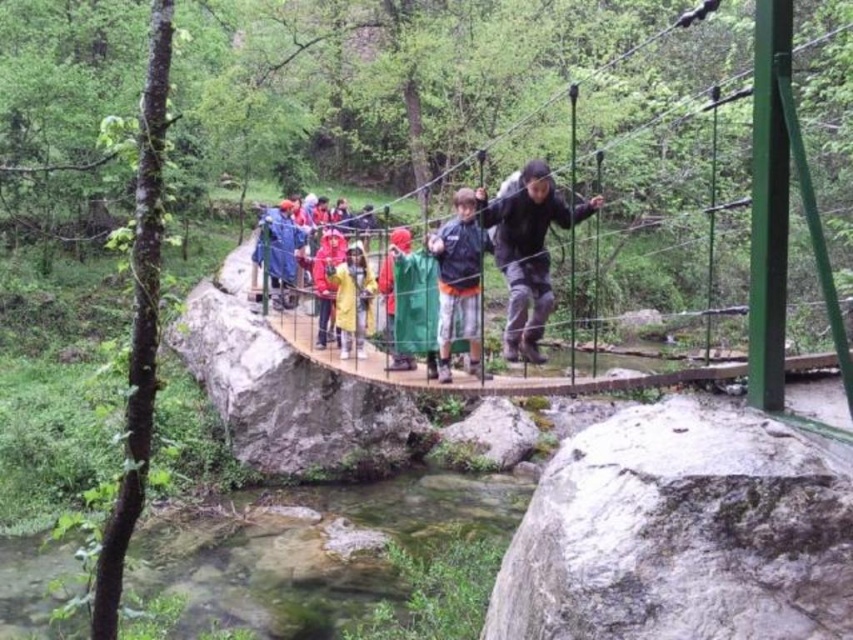
Question: Which point is closer to the camera?

Choices:
 (A) (845, 515)
 (B) (238, 320)
 (C) (268, 257)

Answer: (A)

Question: Is gray/rough rock at lower right positioned before yellow waterproof jacket at center?

Choices:
 (A) yes
 (B) no

Answer: (A)

Question: Which point appears farthest from the camera in this image?

Choices:
 (A) (769, 10)
 (B) (389, 364)
 (C) (231, 304)
 (D) (527, 301)

Answer: (C)

Question: Which point appears farthest from the camera in this image?

Choices:
 (A) (302, 467)
 (B) (273, 225)
 (C) (329, 515)

Answer: (B)

Question: Does smooth gray rock at center appear over yellow waterproof jacket at center?

Choices:
 (A) no
 (B) yes

Answer: (A)

Question: Can you confirm if gray/rough rock at lower right is bigger than wooden bridge at center?

Choices:
 (A) yes
 (B) no

Answer: (B)